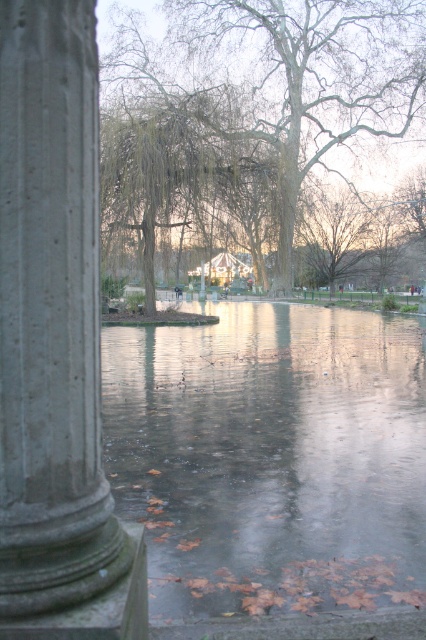
The image size is (426, 640). What are the coordinates of `gray stone column at left` in the screenshot? It's located at (55, 342).

Between gray stone column at left and smooth bark tree at center, which one has less height?

With less height is gray stone column at left.

Who is more distant from viewer, (8, 552) or (146, 67)?

The point (146, 67) is behind.

Find the location of a particular element. The image size is (426, 640). gray stone column at left is located at coordinates (55, 342).

This screenshot has width=426, height=640. Identify the location of translucent ice at center. (270, 458).

How far apart are translucent ice at center and gray stone column at left?

A distance of 5.89 meters exists between translucent ice at center and gray stone column at left.

Is point (314, 481) farther from camera compared to point (34, 564)?

Yes, it is behind point (34, 564).

Locate an element on the screen. translucent ice at center is located at coordinates (270, 458).

The image size is (426, 640). I want to click on translucent ice at center, so click(270, 458).

Looking at this image, can you confirm if translucent ice at center is smaller than smooth bark tree at center?

Correct, translucent ice at center occupies less space than smooth bark tree at center.

Between point (118, 344) and point (273, 76), which one is positioned in front?

Point (118, 344) is in front.

You are a GUI agent. You are given a task and a screenshot of the screen. Output one action in this format:
    pyautogui.click(x=<x>, y=<y>)
    Task: Click on the translucent ice at center
    The image size is (426, 640).
    Given the screenshot: What is the action you would take?
    pyautogui.click(x=270, y=458)